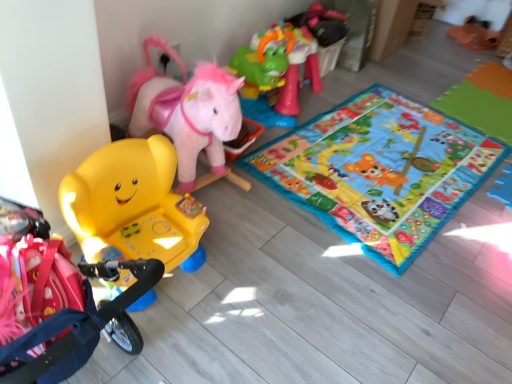
Find the location of a particular element. This screenshot has width=512, height=384. matte yellow plastic chair at left, positioned as the first toy in front-to-back order is located at coordinates (133, 206).

This screenshot has height=384, width=512. Identify the location of matte yellow plastic chair at left, positioned as the first toy in front-to-back order. (133, 206).

From the image's perspective, is multicolored fabric playmat at center on green plastic horse at upper right, positioned as the 2th toy in bottom-to-top order?

No, from the image's perspective, multicolored fabric playmat at center is not over green plastic horse at upper right, positioned as the 2th toy in bottom-to-top order.

Is point (300, 151) closer or farther from the camera than point (289, 30)?

Point (300, 151).

Locate an element on the screen. This screenshot has height=384, width=512. toy behind the multicolored fabric playmat at center is located at coordinates (288, 62).

Is multicolored fabric playmat at center looking in the opposite direction of green plastic horse at upper right, positioned as the 1th toy in top-to-bottom order?

multicolored fabric playmat at center does not have its back to green plastic horse at upper right, positioned as the 1th toy in top-to-bottom order.

Measure the distance between green plastic horse at upper right, the 2th toy from the front, and multicolored fabric playmat at center.

A distance of 20.87 inches exists between green plastic horse at upper right, the 2th toy from the front, and multicolored fabric playmat at center.

Which is behind, point (287, 80) or point (380, 250)?

Positioned behind is point (287, 80).

Is green plastic horse at upper right, the 1th toy positioned from the right, in front of or behind multicolored fabric playmat at center in the image?

Clearly, green plastic horse at upper right, the 1th toy positioned from the right, is behind multicolored fabric playmat at center.

Considering the relative positions of green plastic horse at upper right, positioned as the 2th toy in bottom-to-top order, and multicolored fabric playmat at center in the image provided, is green plastic horse at upper right, positioned as the 2th toy in bottom-to-top order, to the right of multicolored fabric playmat at center from the viewer's perspective?

No, green plastic horse at upper right, positioned as the 2th toy in bottom-to-top order, is not to the right of multicolored fabric playmat at center.

From the image's perspective, is matte yellow plastic chair at left, which is the first toy from bottom to top, over green plastic horse at upper right, which is counted as the first toy, starting from the back?

Incorrect, from the image's perspective, matte yellow plastic chair at left, which is the first toy from bottom to top, is lower than green plastic horse at upper right, which is counted as the first toy, starting from the back.

Which object is further away from the camera, matte yellow plastic chair at left, positioned as the first toy in front-to-back order, or green plastic horse at upper right, the 1th toy positioned from the right?

green plastic horse at upper right, the 1th toy positioned from the right, is further away from the camera.

Can you confirm if matte yellow plastic chair at left, which is the first toy from bottom to top, is smaller than green plastic horse at upper right, marked as the 2th toy in a left-to-right arrangement?

Indeed, matte yellow plastic chair at left, which is the first toy from bottom to top, has a smaller size compared to green plastic horse at upper right, marked as the 2th toy in a left-to-right arrangement.

Is point (108, 212) farther from camera compared to point (258, 87)?

No.

Which is in front, green plastic horse at upper right, positioned as the 2th toy in bottom-to-top order, or matte yellow plastic chair at left, positioned as the first toy in front-to-back order?

→ matte yellow plastic chair at left, positioned as the first toy in front-to-back order.

Which of these two, green plastic horse at upper right, the 1th toy positioned from the right, or matte yellow plastic chair at left, marked as the first toy in a left-to-right arrangement, is bigger?

With larger size is green plastic horse at upper right, the 1th toy positioned from the right.

From the image's perspective, is green plastic horse at upper right, the 2th toy from the front, under matte yellow plastic chair at left, which is counted as the second toy, starting from the back?

Actually, green plastic horse at upper right, the 2th toy from the front, appears above matte yellow plastic chair at left, which is counted as the second toy, starting from the back, in the image.

Does point (292, 86) come closer to viewer compared to point (98, 226)?

No, (292, 86) is behind (98, 226).

Which of these two, multicolored fabric playmat at center or matte yellow plastic chair at left, which is counted as the second toy, starting from the back, is wider?

With larger width is multicolored fabric playmat at center.

Is multicolored fabric playmat at center in front of or behind matte yellow plastic chair at left, arranged as the second toy when viewed from the top, in the image?

In the image, multicolored fabric playmat at center appears behind matte yellow plastic chair at left, arranged as the second toy when viewed from the top.

Locate an element on the screen. The height and width of the screenshot is (384, 512). yoga mat above the matte yellow plastic chair at left, marked as the first toy in a left-to-right arrangement (from the image's perspective) is located at coordinates (379, 171).

Does multicolored fabric playmat at center have a greater height compared to matte yellow plastic chair at left, the 2th toy in the right-to-left sequence?

Incorrect, the height of multicolored fabric playmat at center is not larger of that of matte yellow plastic chair at left, the 2th toy in the right-to-left sequence.

What's the angular difference between matte yellow plastic chair at left, the 2th toy in the right-to-left sequence, and multicolored fabric playmat at center's facing directions?

The angular difference between matte yellow plastic chair at left, the 2th toy in the right-to-left sequence, and multicolored fabric playmat at center is 93.5 degrees.

Does matte yellow plastic chair at left, marked as the first toy in a left-to-right arrangement, touch multicolored fabric playmat at center?

They are not placed beside each other.

Between matte yellow plastic chair at left, which is counted as the second toy, starting from the back, and multicolored fabric playmat at center, which one has more height?

matte yellow plastic chair at left, which is counted as the second toy, starting from the back.

Measure the distance from matte yellow plastic chair at left, positioned as the first toy in front-to-back order, to multicolored fabric playmat at center.

matte yellow plastic chair at left, positioned as the first toy in front-to-back order, is 33.97 inches away from multicolored fabric playmat at center.

I want to click on yoga mat below the green plastic horse at upper right, positioned as the 2th toy in bottom-to-top order (from the image's perspective), so click(x=379, y=171).

Identify the location of yoga mat that is under the green plastic horse at upper right, marked as the 2th toy in a left-to-right arrangement (from a real-world perspective). The height and width of the screenshot is (384, 512). (379, 171).

When comparing their distances from multicolored fabric playmat at center, does green plastic horse at upper right, positioned as the 2th toy in bottom-to-top order, or matte yellow plastic chair at left, the 2th toy in the right-to-left sequence, seem further?

matte yellow plastic chair at left, the 2th toy in the right-to-left sequence.

Consider the image. Looking at the image, which one is located closer to green plastic horse at upper right, the 1th toy positioned from the right, matte yellow plastic chair at left, the 2th toy in the right-to-left sequence, or multicolored fabric playmat at center?

multicolored fabric playmat at center is positioned closer to the anchor green plastic horse at upper right, the 1th toy positioned from the right.

When comparing their distances from green plastic horse at upper right, marked as the 2th toy in a left-to-right arrangement, does multicolored fabric playmat at center or matte yellow plastic chair at left, marked as the first toy in a left-to-right arrangement, seem closer?

multicolored fabric playmat at center.

Looking at this image, when comparing their distances from matte yellow plastic chair at left, which is counted as the second toy, starting from the back, does green plastic horse at upper right, positioned as the 2th toy in bottom-to-top order, or multicolored fabric playmat at center seem further?

Among the two, green plastic horse at upper right, positioned as the 2th toy in bottom-to-top order, is located further to matte yellow plastic chair at left, which is counted as the second toy, starting from the back.

When comparing their distances from multicolored fabric playmat at center, does matte yellow plastic chair at left, the 2th toy in the right-to-left sequence, or green plastic horse at upper right, marked as the 2th toy in a left-to-right arrangement, seem further?

matte yellow plastic chair at left, the 2th toy in the right-to-left sequence, is positioned further to the anchor multicolored fabric playmat at center.

Which object lies further to the anchor point matte yellow plastic chair at left, arranged as the second toy when viewed from the top, multicolored fabric playmat at center or green plastic horse at upper right, marked as the 2th toy in a left-to-right arrangement?

A: Among the two, green plastic horse at upper right, marked as the 2th toy in a left-to-right arrangement, is located further to matte yellow plastic chair at left, arranged as the second toy when viewed from the top.

Where is `toy between matte yellow plastic chair at left, which is counted as the second toy, starting from the back, and multicolored fabric playmat at center`? toy between matte yellow plastic chair at left, which is counted as the second toy, starting from the back, and multicolored fabric playmat at center is located at coordinates (288, 62).